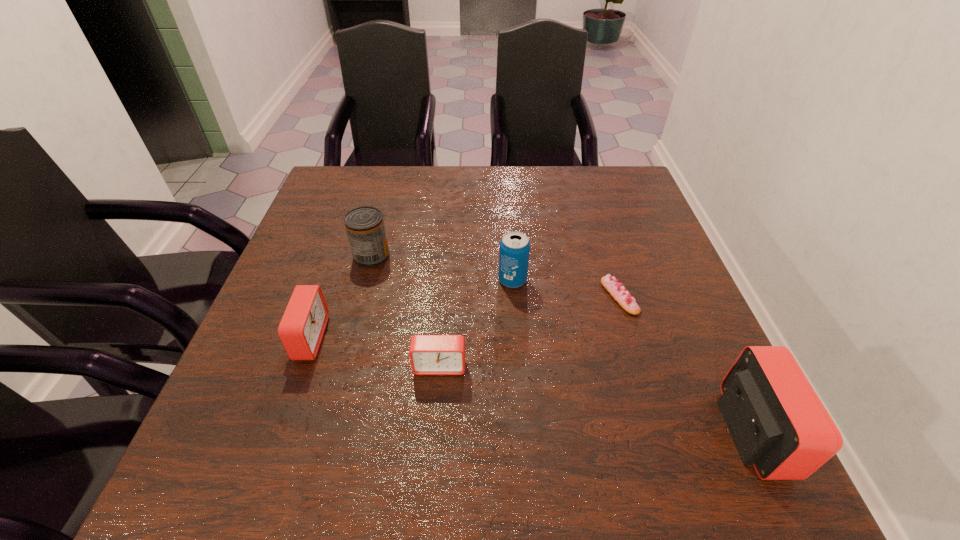
The image size is (960, 540). I want to click on the leftmost alarm clock, so click(302, 327).

I want to click on the fourth tallest object, so click(302, 327).

You are a GUI agent. You are given a task and a screenshot of the screen. Output one action in this format:
    pyautogui.click(x=<x>, y=<y>)
    Task: Click on the second alarm clock from left to right
    This screenshot has height=540, width=960.
    Given the screenshot: What is the action you would take?
    429,354

In order to click on the fifth tallest object in this screenshot , I will do `click(429, 354)`.

I want to click on the rightmost alarm clock, so click(x=778, y=424).

The image size is (960, 540). I want to click on the rightmost object, so click(778, 424).

The width and height of the screenshot is (960, 540). Find the location of `the fifth object from right to left`. the fifth object from right to left is located at coordinates (365, 227).

You are a GUI agent. You are given a task and a screenshot of the screen. Output one action in this format:
    pyautogui.click(x=<x>, y=<y>)
    Task: Click on the farthest object
    
    Given the screenshot: What is the action you would take?
    pyautogui.click(x=365, y=227)

The height and width of the screenshot is (540, 960). What are the coordinates of `soda can` in the screenshot? It's located at (514, 252).

Find the location of a particular element. eclair is located at coordinates (617, 291).